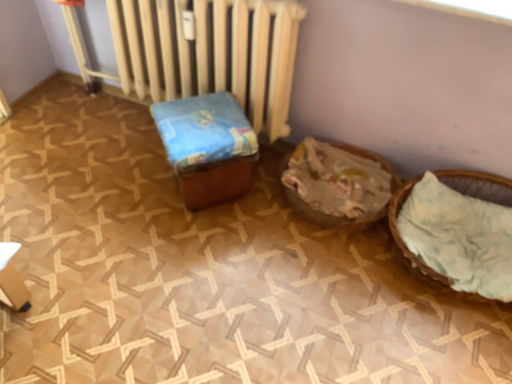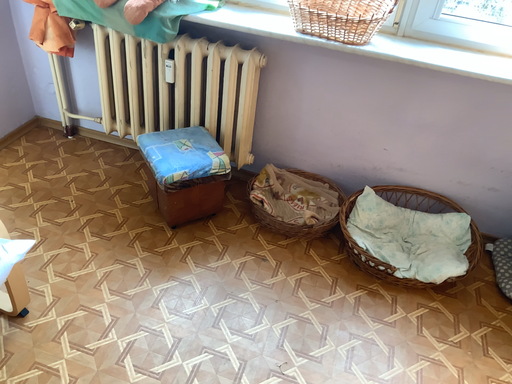
Question: Which way did the camera rotate in the video?

Choices:
 (A) rotated right
 (B) rotated left

Answer: (A)